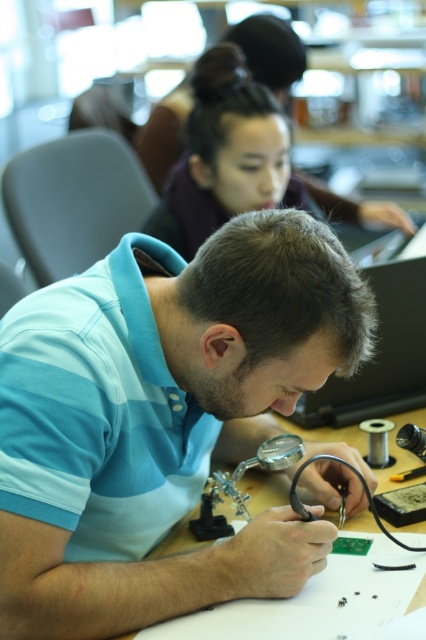
Question: Among these objects, which one is nearest to the camera?

Choices:
 (A) blue striped shirt at center
 (B) matte purple shirt at upper center
 (C) wooden table at center

Answer: (A)

Question: Observing the image, what is the correct spatial positioning of blue striped shirt at center in reference to matte purple shirt at upper center?

Choices:
 (A) left
 (B) right

Answer: (A)

Question: Is blue striped shirt at center further to the viewer compared to wooden table at center?

Choices:
 (A) no
 (B) yes

Answer: (A)

Question: Which object appears farthest from the camera in this image?

Choices:
 (A) blue striped shirt at center
 (B) matte purple shirt at upper center
 (C) wooden table at center

Answer: (B)

Question: Is matte purple shirt at upper center positioned behind wooden table at center?

Choices:
 (A) yes
 (B) no

Answer: (A)

Question: Which object appears closest to the camera in this image?

Choices:
 (A) blue striped shirt at center
 (B) matte purple shirt at upper center
 (C) wooden table at center

Answer: (A)